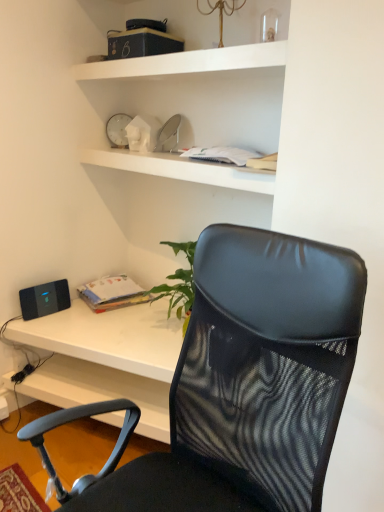
Question: Does black matte speaker at lower left have a lesser height compared to matte paper book at center?

Choices:
 (A) no
 (B) yes

Answer: (A)

Question: Is black matte speaker at lower left bigger than matte paper book at center?

Choices:
 (A) yes
 (B) no

Answer: (B)

Question: From the image's perspective, would you say black matte speaker at lower left is shown under matte paper book at center?

Choices:
 (A) no
 (B) yes

Answer: (B)

Question: From a real-world perspective, is black matte speaker at lower left physically below matte paper book at center?

Choices:
 (A) no
 (B) yes

Answer: (A)

Question: Is black matte speaker at lower left behind matte paper book at center?

Choices:
 (A) no
 (B) yes

Answer: (A)

Question: Looking at their shapes, would you say black matte speaker at lower left is wider or thinner than white plastic clock at upper center?

Choices:
 (A) wide
 (B) thin

Answer: (B)

Question: Is black matte speaker at lower left in front of or behind white plastic clock at upper center in the image?

Choices:
 (A) behind
 (B) front

Answer: (B)

Question: Based on their sizes in the image, would you say black matte speaker at lower left is bigger or smaller than white plastic clock at upper center?

Choices:
 (A) small
 (B) big

Answer: (A)

Question: From the image's perspective, is black matte speaker at lower left above or below white plastic clock at upper center?

Choices:
 (A) above
 (B) below

Answer: (B)

Question: Is point (34, 286) positioned closer to the camera than point (99, 74)?

Choices:
 (A) farther
 (B) closer

Answer: (A)

Question: Is black matte speaker at lower left to the left or to the right of white matte shelf at upper center in the image?

Choices:
 (A) left
 (B) right

Answer: (A)

Question: Would you say black matte speaker at lower left is inside or outside white matte shelf at upper center?

Choices:
 (A) inside
 (B) outside

Answer: (B)

Question: Looking at their shapes, would you say black matte speaker at lower left is wider or thinner than white matte shelf at upper center?

Choices:
 (A) wide
 (B) thin

Answer: (B)

Question: From their relative heights in the image, would you say white matte shelf at upper center is taller or shorter than matte paper book at center?

Choices:
 (A) short
 (B) tall

Answer: (B)

Question: Is white matte shelf at upper center inside or outside of matte paper book at center?

Choices:
 (A) inside
 (B) outside

Answer: (B)